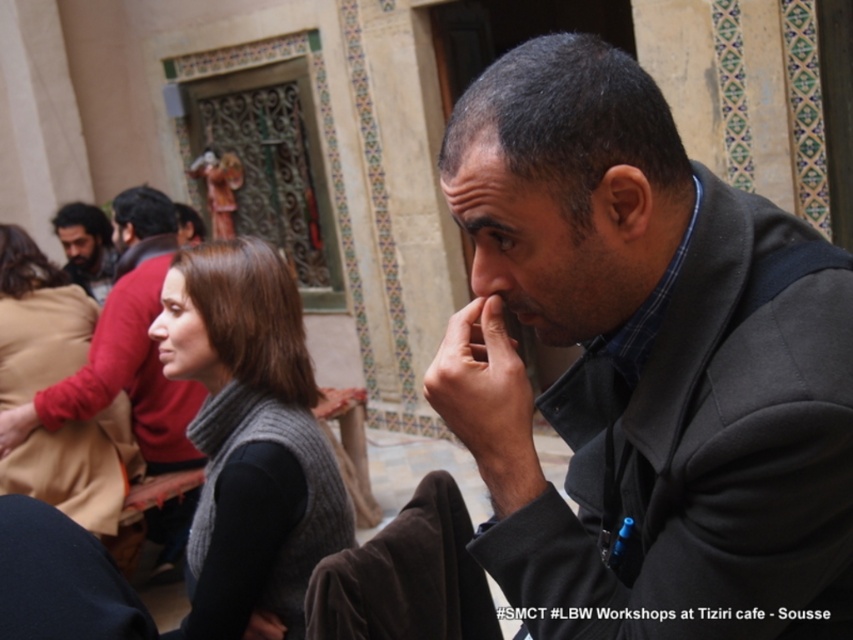
Can you confirm if gray knitted vest at center is smaller than matte black nose at center?

Incorrect, gray knitted vest at center is not smaller in size than matte black nose at center.

Identify the location of gray knitted vest at center. Image resolution: width=853 pixels, height=640 pixels. (248, 436).

The height and width of the screenshot is (640, 853). Find the location of `gray knitted vest at center`. gray knitted vest at center is located at coordinates (248, 436).

Identify the location of gray knitted vest at center. The width and height of the screenshot is (853, 640). (248, 436).

Does dark skin hand at center come behind matte black hand at lower center?

That is False.

Does dark skin hand at center have a lesser width compared to matte black hand at lower center?

No.

Who is more forward, (x=497, y=381) or (x=270, y=634)?

Point (x=497, y=381) is in front.

The image size is (853, 640). Identify the location of dark skin hand at center. (483, 390).

Is the position of knitted gray scarf at center less distant than that of matte black nose at center?

Yes, it is.

Between knitted gray scarf at center and matte black nose at center, which one is positioned lower?

knitted gray scarf at center is lower down.

Identify the location of knitted gray scarf at center. Image resolution: width=853 pixels, height=640 pixels. (38, 320).